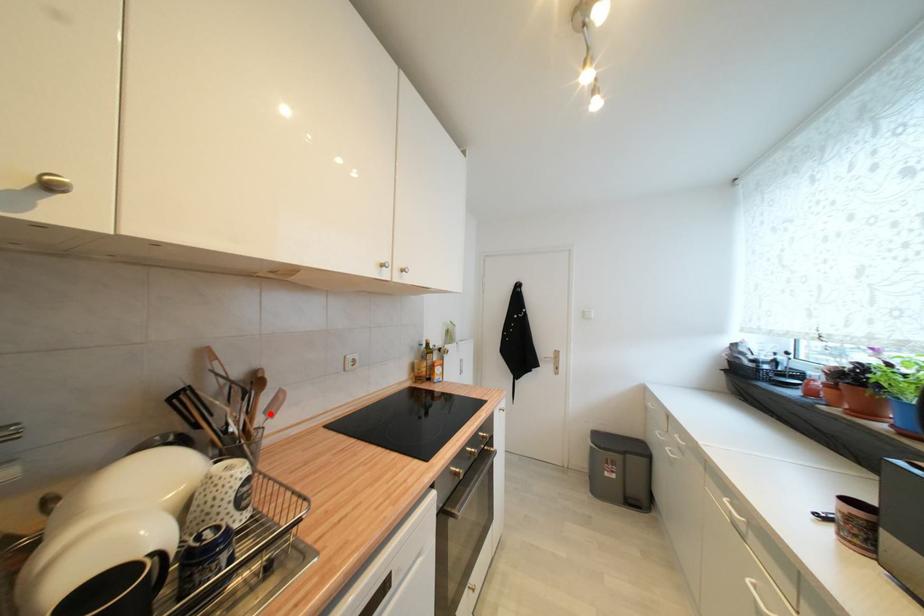
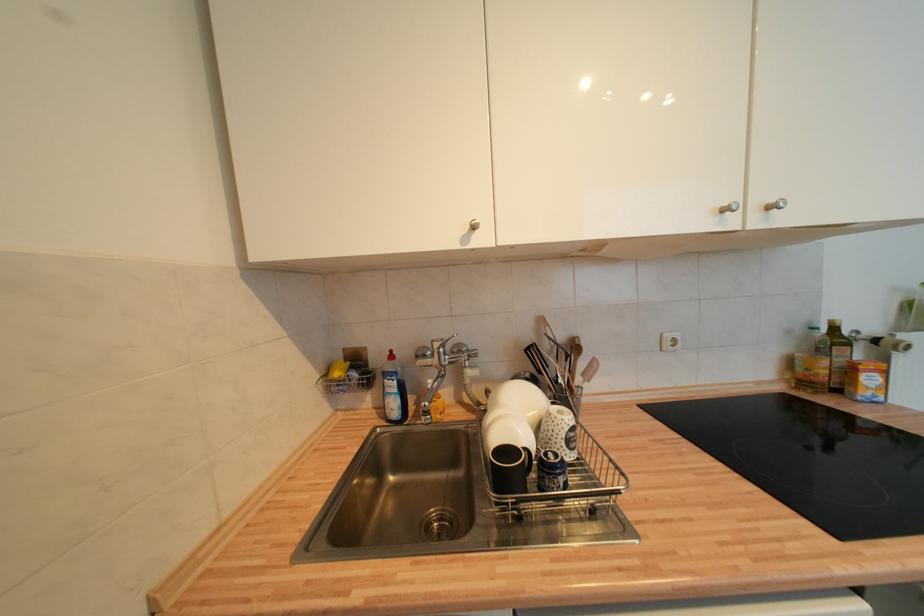
The point at the highlighted location is marked in the first image. Where is the corresponding point in the second image?

(588, 377)